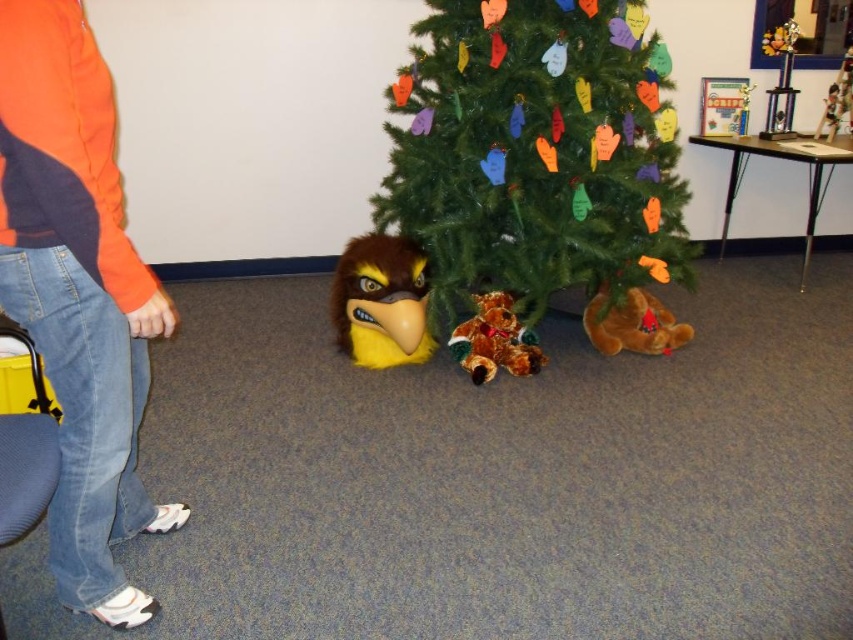
You are standing in the classroom and want to place a new decoration on the orange fleece jacket at upper left. According to the image, what are the exact coordinates where you should place it?

The exact coordinates for placing the decoration on the orange fleece jacket at upper left are at point [78,294].